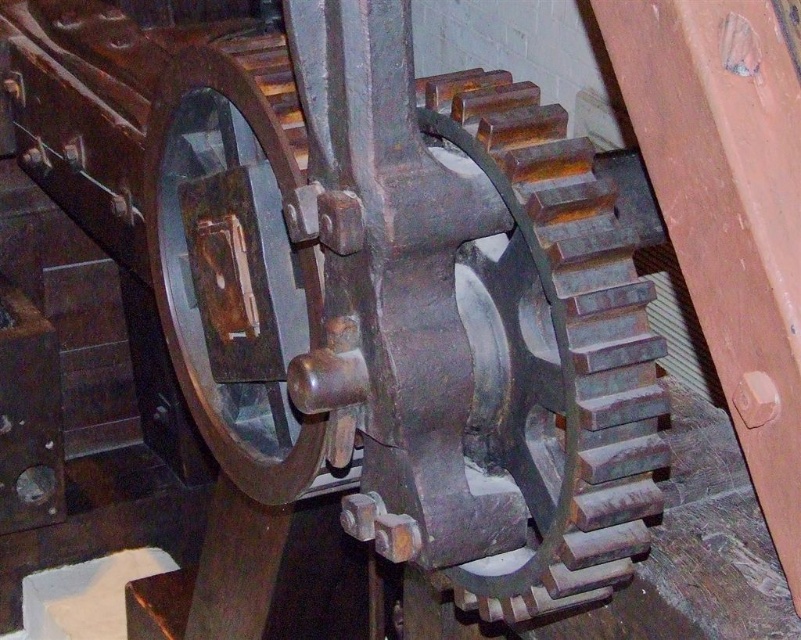
Which is below, rusty metal gear at center or metallic polished wheel at center?

rusty metal gear at center is lower down.

Can you confirm if rusty metal gear at center is bigger than metallic polished wheel at center?

No.

This screenshot has height=640, width=801. In order to click on rusty metal gear at center in this screenshot , I will do `click(492, 349)`.